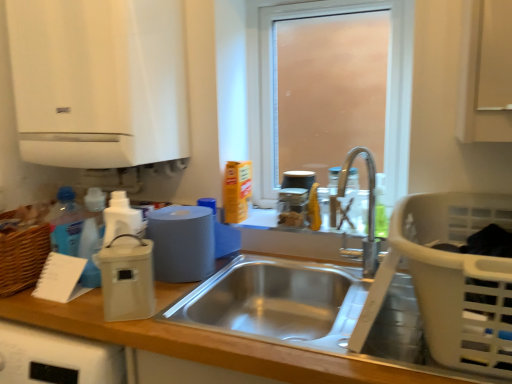
Question: Is translucent glass jars at upper center, the 1th appliance when ordered from right to left, further to the viewer compared to wooden at left?

Choices:
 (A) yes
 (B) no

Answer: (A)

Question: From the image's perspective, is translucent glass jars at upper center, the 1th appliance when ordered from right to left, located beneath wooden at left?

Choices:
 (A) yes
 (B) no

Answer: (B)

Question: Is translucent glass jars at upper center, acting as the first appliance starting from the back, positioned before wooden at left?

Choices:
 (A) no
 (B) yes

Answer: (A)

Question: Could wooden at left be considered to be inside translucent glass jars at upper center, acting as the first appliance starting from the back?

Choices:
 (A) no
 (B) yes

Answer: (A)

Question: Could you tell me if translucent glass jars at upper center, the 1th appliance when ordered from right to left, is turned towards wooden at left?

Choices:
 (A) no
 (B) yes

Answer: (A)

Question: Is translucent glass jars at upper center, the 1th appliance when ordered from right to left, taller than wooden at left?

Choices:
 (A) yes
 (B) no

Answer: (B)

Question: Is frosted glass window at center bigger than stainless steel sink at center?

Choices:
 (A) no
 (B) yes

Answer: (A)

Question: Is frosted glass window at center next to stainless steel sink at center?

Choices:
 (A) yes
 (B) no

Answer: (B)

Question: Can you confirm if frosted glass window at center is wider than stainless steel sink at center?

Choices:
 (A) no
 (B) yes

Answer: (A)

Question: Considering the relative positions of frosted glass window at center and stainless steel sink at center in the image provided, is frosted glass window at center to the left of stainless steel sink at center from the viewer's perspective?

Choices:
 (A) no
 (B) yes

Answer: (A)

Question: Can you confirm if frosted glass window at center is shorter than stainless steel sink at center?

Choices:
 (A) no
 (B) yes

Answer: (A)

Question: Is frosted glass window at center oriented towards stainless steel sink at center?

Choices:
 (A) yes
 (B) no

Answer: (A)

Question: From a real-world perspective, is stainless steel sink at center positioned over beige plastic container at left, the third appliance positioned from the back, based on gravity?

Choices:
 (A) no
 (B) yes

Answer: (A)